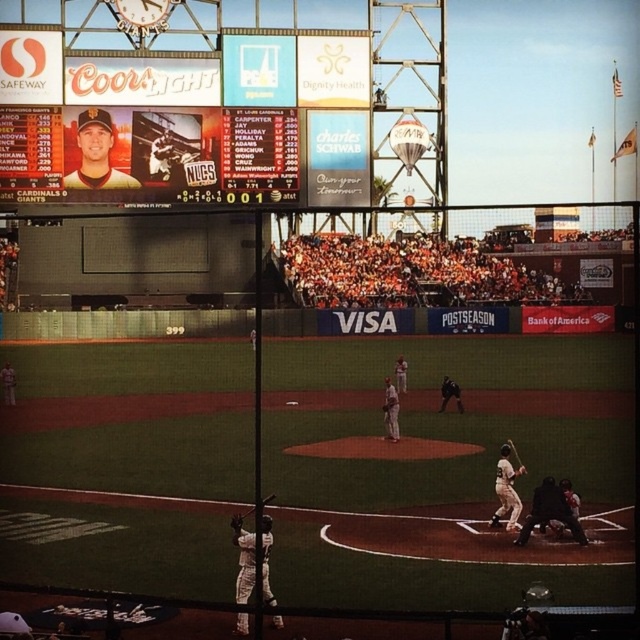
Question: Estimate the real-world distances between objects in this image. Which object is closer to the white matte baseball bat at center?

Choices:
 (A) matte plastic scoreboard at upper center
 (B) white matte uniform at center

Answer: (B)

Question: Which of these objects is positioned closest to the black matte umpire at lower right?

Choices:
 (A) wooden bat at center
 (B) brown leather glove at lower center
 (C) wooden baseball bat at center

Answer: (A)

Question: Does wooden baseball bat at center have a lesser width compared to brown leather glove at lower center?

Choices:
 (A) no
 (B) yes

Answer: (A)

Question: Which object appears closest to the camera in this image?

Choices:
 (A) brown leather glove at lower center
 (B) black matte umpire at lower right
 (C) white matte baseball bat at center
 (D) white uniform bat at center

Answer: (C)

Question: Is matte plastic scoreboard at upper center wider than wooden baseball bat at center?

Choices:
 (A) yes
 (B) no

Answer: (A)

Question: Can you confirm if black matte umpire at lower right is positioned above wooden baseball bat at center?

Choices:
 (A) yes
 (B) no

Answer: (A)